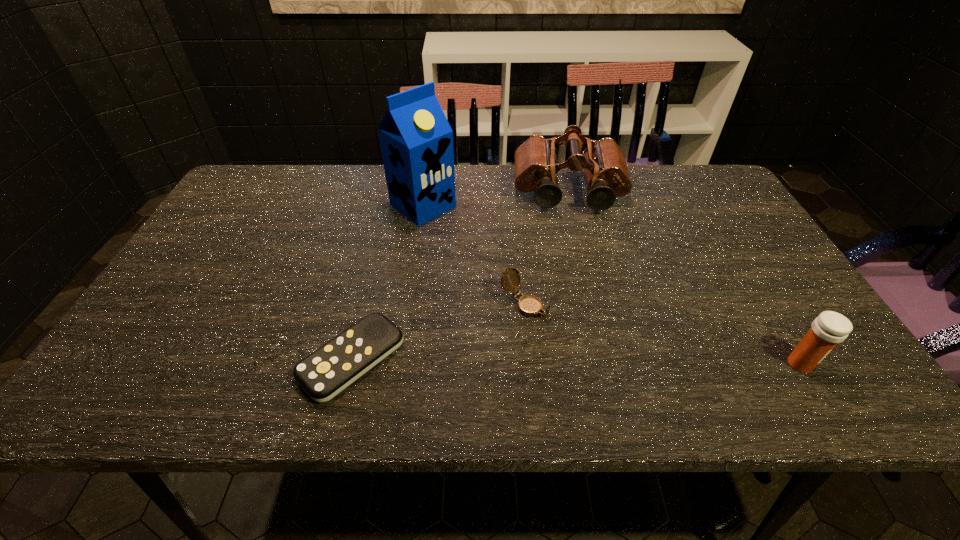
Find the location of a particular element. The height and width of the screenshot is (540, 960). free space between the tallest object and the fourth tallest object is located at coordinates (474, 255).

Identify the location of vacant point located between the medicine and the tallest object. Image resolution: width=960 pixels, height=540 pixels. (612, 285).

Locate an element on the screen. The width and height of the screenshot is (960, 540). vacant space that's between the carton and the fourth shortest object is located at coordinates (496, 199).

This screenshot has width=960, height=540. Find the location of `free space between the rightmost object and the binoculars`. free space between the rightmost object and the binoculars is located at coordinates (684, 279).

Locate an element on the screen. The width and height of the screenshot is (960, 540). free space between the carton and the binoculars is located at coordinates (496, 199).

At what (x,y) coordinates should I click in order to perform the action: click on free area in between the shortest object and the second shortest object. Please return your answer as a coordinate pair (x, y). Image resolution: width=960 pixels, height=540 pixels. Looking at the image, I should click on (439, 332).

This screenshot has height=540, width=960. Find the location of `free space between the second shortest object and the shortest object`. free space between the second shortest object and the shortest object is located at coordinates (439, 332).

Where is `object that can be found as the second closest to the carton`? object that can be found as the second closest to the carton is located at coordinates (529, 305).

At what (x,y) coordinates should I click in order to perform the action: click on object that can be found as the closest to the binoculars. Please return your answer as a coordinate pair (x, y). The width and height of the screenshot is (960, 540). Looking at the image, I should click on (416, 140).

Image resolution: width=960 pixels, height=540 pixels. Find the location of `free region that satisfies the following two spatial constraints: 1. on the back side of the carton; 2. on the right side of the fourth shortest object`. free region that satisfies the following two spatial constraints: 1. on the back side of the carton; 2. on the right side of the fourth shortest object is located at coordinates (425, 193).